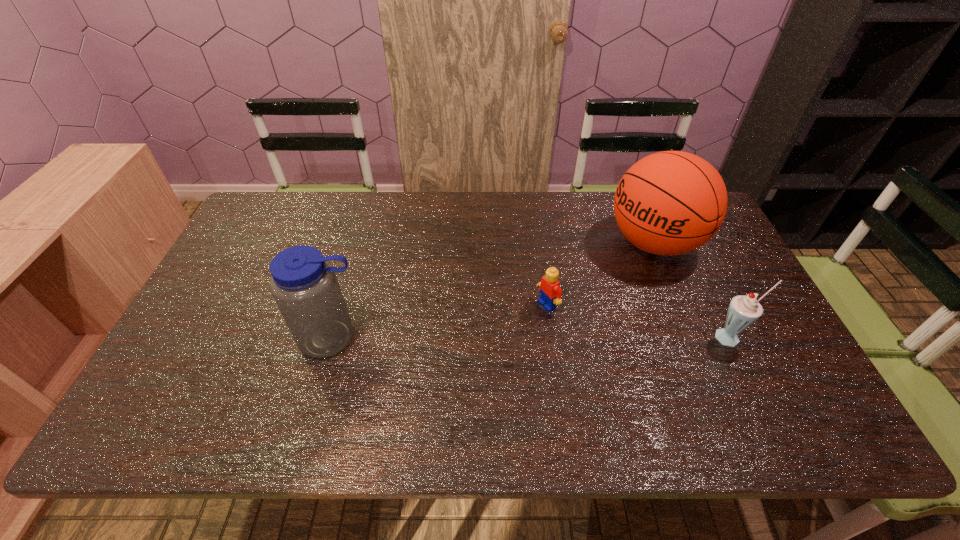
This screenshot has height=540, width=960. I want to click on vacant area that lies between the farthest object and the leftmost object, so 493,291.

Where is `vacant area that lies between the farthest object and the water bottle`? The image size is (960, 540). vacant area that lies between the farthest object and the water bottle is located at coordinates (493, 291).

Where is `object that ranks as the closest to the farthest object`? The height and width of the screenshot is (540, 960). object that ranks as the closest to the farthest object is located at coordinates (744, 310).

Point out which object is positioned as the second nearest to the milkshake. Please provide its 2D coordinates. Your answer should be formatted as a tuple, i.e. [(x, y)], where the tuple contains the x and y coordinates of a point satisfying the conditions above.

[(550, 292)]